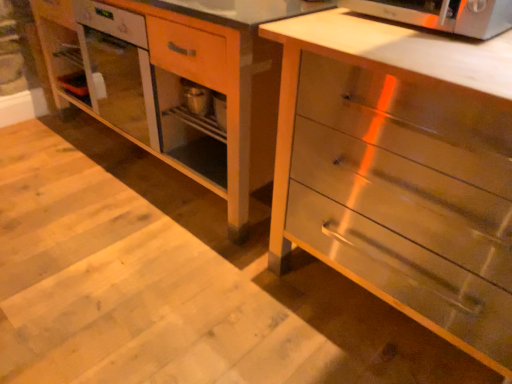
Locate an element on the screen. Image resolution: width=512 pixels, height=384 pixels. metallic silver chest of drawers at center is located at coordinates (401, 170).

Measure the distance between satin silver microwave oven at upper right and camera.

A distance of 3.43 feet exists between satin silver microwave oven at upper right and camera.

Where is `wooden vanity at center`? wooden vanity at center is located at coordinates (179, 81).

Does wooden vanity at center have a smaller size compared to metallic silver chest of drawers at center?

No.

You are a GUI agent. You are given a task and a screenshot of the screen. Output one action in this format:
    pyautogui.click(x=<x>, y=<y>)
    Task: Click on the chest of drawers on the right of wooden vanity at center
    Image resolution: width=512 pixels, height=384 pixels.
    Given the screenshot: What is the action you would take?
    pyautogui.click(x=401, y=170)

Between point (203, 185) and point (293, 183), which one is positioned behind?

The point (203, 185) is farther.

Is wooden vanity at center surrounding metallic silver chest of drawers at center?

No, metallic silver chest of drawers at center is not inside wooden vanity at center.

Who is more distant, metallic silver chest of drawers at center or wooden vanity at center?

wooden vanity at center is further away from the camera.

Can you confirm if metallic silver chest of drawers at center is positioned to the left of wooden vanity at center?

No.

From the image's perspective, which object appears higher, metallic silver chest of drawers at center or wooden vanity at center?

From the image's view, wooden vanity at center is above.

How far apart are metallic silver chest of drawers at center and wooden vanity at center?

A distance of 25.12 inches exists between metallic silver chest of drawers at center and wooden vanity at center.

Between wooden vanity at center and satin silver microwave oven at upper right, which one has more height?

wooden vanity at center is taller.

Considering the relative positions of wooden vanity at center and satin silver microwave oven at upper right in the image provided, is wooden vanity at center in front of satin silver microwave oven at upper right?

No, it is behind satin silver microwave oven at upper right.

Can you tell me how much wooden vanity at center and satin silver microwave oven at upper right differ in facing direction?

0.361 degrees.

Which point is more distant from viewer, [39,26] or [470,15]?

The point [39,26] is behind.

Which is behind, metallic silver chest of drawers at center or satin silver microwave oven at upper right?

satin silver microwave oven at upper right is more distant.

From the image's perspective, is metallic silver chest of drawers at center beneath satin silver microwave oven at upper right?

Yes.

From a real-world perspective, between metallic silver chest of drawers at center and satin silver microwave oven at upper right, who is vertically lower?

metallic silver chest of drawers at center is physically lower.

Does point (391, 11) lie behind point (375, 154)?

Yes, it is.

From their relative heights in the image, would you say satin silver microwave oven at upper right is taller or shorter than metallic silver chest of drawers at center?

Clearly, satin silver microwave oven at upper right is shorter compared to metallic silver chest of drawers at center.

Is satin silver microwave oven at upper right turned away from metallic silver chest of drawers at center?

That's not correct — satin silver microwave oven at upper right is not looking away from metallic silver chest of drawers at center.

Is satin silver microwave oven at upper right positioned in front of metallic silver chest of drawers at center?

No, satin silver microwave oven at upper right is further to the viewer.

From a real-world perspective, is satin silver microwave oven at upper right physically above wooden vanity at center?

Yes.

How much distance is there between satin silver microwave oven at upper right and wooden vanity at center?

satin silver microwave oven at upper right is 31.82 inches away from wooden vanity at center.

Does point (381, 18) appear closer or farther from the camera than point (211, 74)?

Point (381, 18) is positioned closer to the camera compared to point (211, 74).

This screenshot has height=384, width=512. I want to click on microwave oven that appears below the wooden vanity at center (from the image's perspective), so pyautogui.click(x=442, y=14).

I want to click on the chest of drawers below the wooden vanity at center (from a real-world perspective), so click(x=401, y=170).

I want to click on chest of drawers on the right of wooden vanity at center, so click(401, 170).

Based on their spatial positions, is satin silver microwave oven at upper right or metallic silver chest of drawers at center further from wooden vanity at center?

The object further to wooden vanity at center is satin silver microwave oven at upper right.

Which object lies nearer to the anchor point wooden vanity at center, metallic silver chest of drawers at center or satin silver microwave oven at upper right?

Based on the image, metallic silver chest of drawers at center appears to be nearer to wooden vanity at center.

Consider the image. Estimate the real-world distances between objects in this image. Which object is closer to satin silver microwave oven at upper right, metallic silver chest of drawers at center or wooden vanity at center?

metallic silver chest of drawers at center lies closer to satin silver microwave oven at upper right than the other object.

Estimate the real-world distances between objects in this image. Which object is further from satin silver microwave oven at upper right, wooden vanity at center or metallic silver chest of drawers at center?

wooden vanity at center is positioned further to the anchor satin silver microwave oven at upper right.

Consider the image. Based on their spatial positions, is satin silver microwave oven at upper right or wooden vanity at center further from metallic silver chest of drawers at center?

Based on the image, wooden vanity at center appears to be further to metallic silver chest of drawers at center.

From the picture: Estimate the real-world distances between objects in this image. Which object is further from metallic silver chest of drawers at center, wooden vanity at center or satin silver microwave oven at upper right?

wooden vanity at center is positioned further to the anchor metallic silver chest of drawers at center.

At what (x,y) coordinates should I click in order to perform the action: click on microwave oven located between wooden vanity at center and metallic silver chest of drawers at center in the left-right direction. Please return your answer as a coordinate pair (x, y). Looking at the image, I should click on (442, 14).